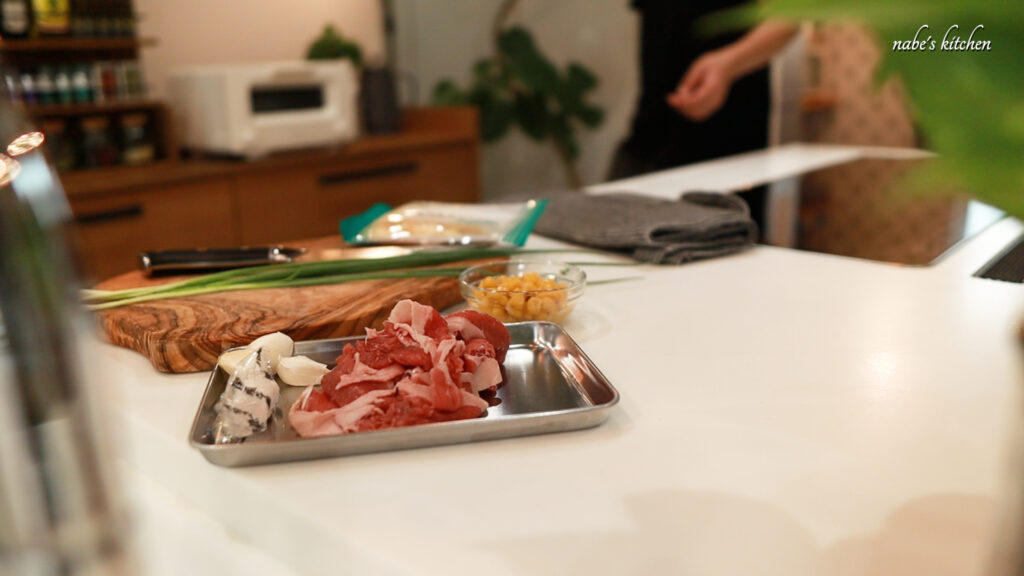
Where is `black cooktop`? black cooktop is located at coordinates (876, 230).